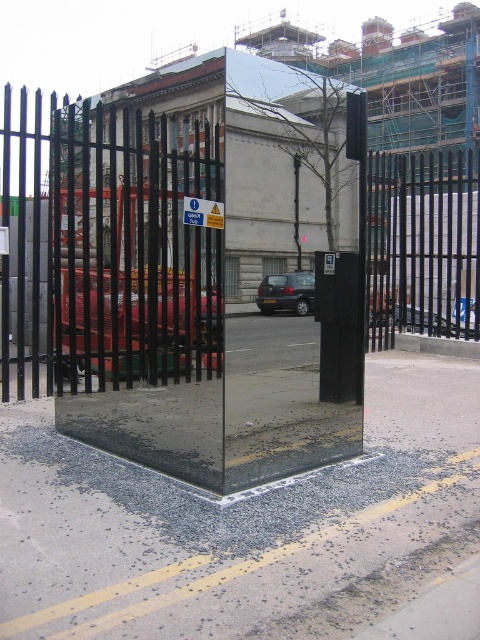
Question: Which point appears closest to the camera in this image?

Choices:
 (A) (295, 291)
 (B) (131, 454)

Answer: (A)

Question: Can you confirm if metallic gate at center is smaller than dark gray metallic car at center?

Choices:
 (A) yes
 (B) no

Answer: (B)

Question: Is metallic gate at center further to the viewer compared to dark gray metallic car at center?

Choices:
 (A) no
 (B) yes

Answer: (A)

Question: Can you confirm if metallic gate at center is smaller than dark gray metallic car at center?

Choices:
 (A) yes
 (B) no

Answer: (B)